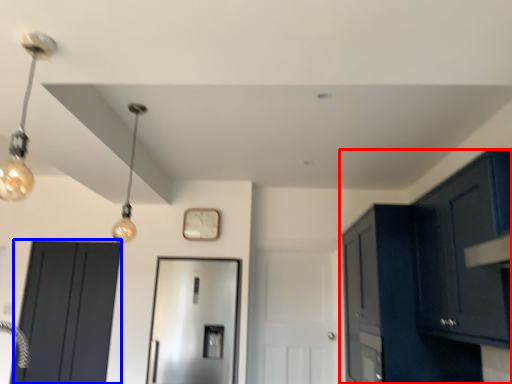
Question: Which object is further to the camera taking this photo, cabinetry (highlighted by a red box) or door (highlighted by a blue box)?

Choices:
 (A) cabinetry
 (B) door

Answer: (B)